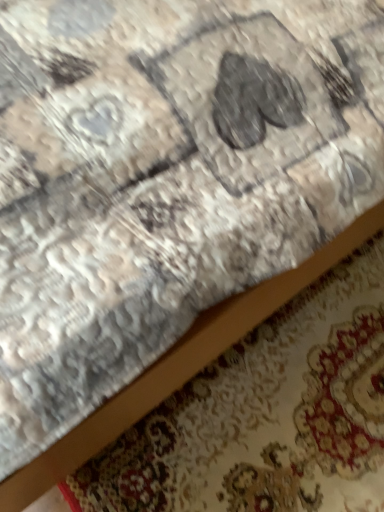
Identify the location of free point above velvety beige mat at center (from a real-world perspective). This screenshot has width=384, height=512. (288, 406).